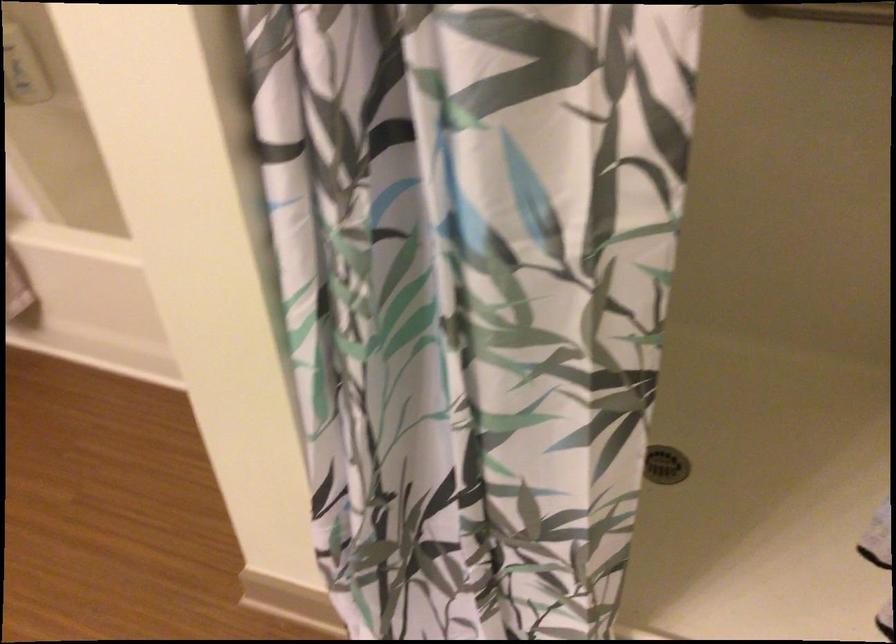
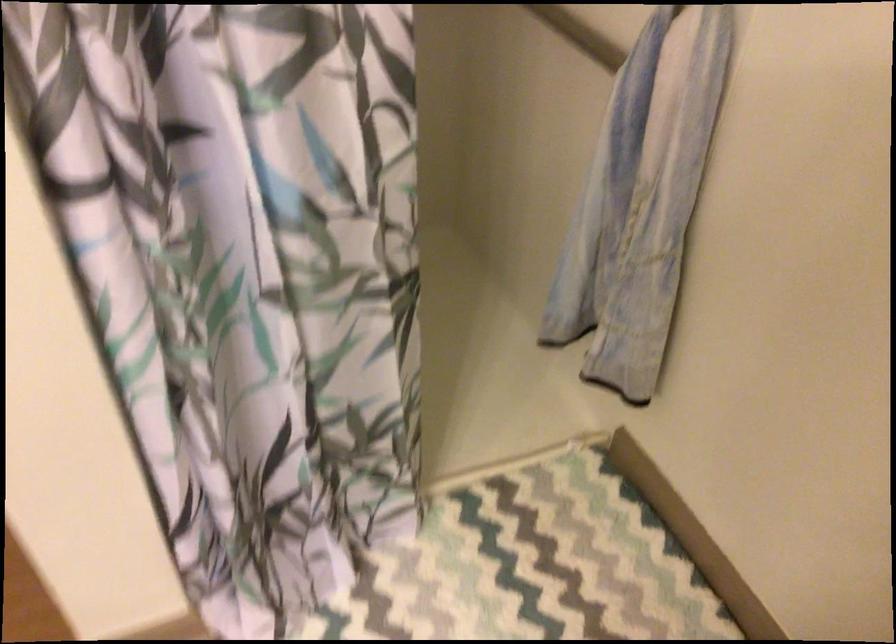
Question: The camera is either moving clockwise (left) or counter-clockwise (right) around the object. The first image is from the beginning of the video and the second image is from the end. Is the camera moving left or right when shooting the video?

Choices:
 (A) Left
 (B) Right

Answer: (A)